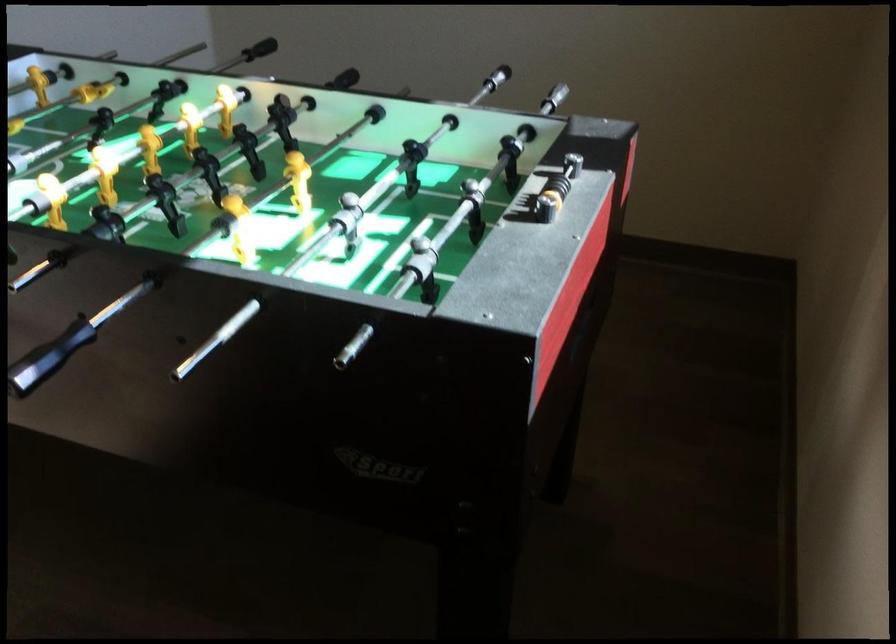
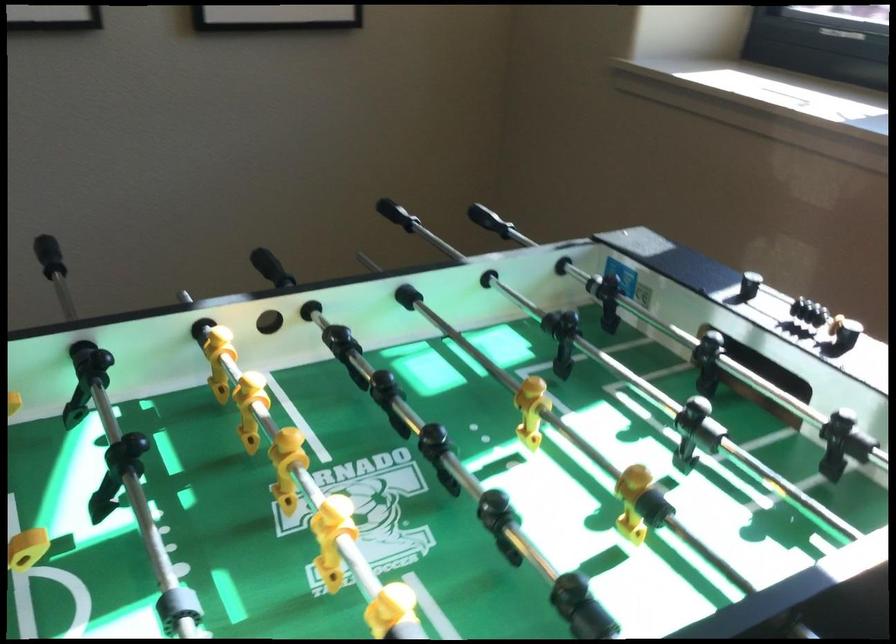
Find the pixel in the second image that matches (592,192) in the first image.

(798, 307)